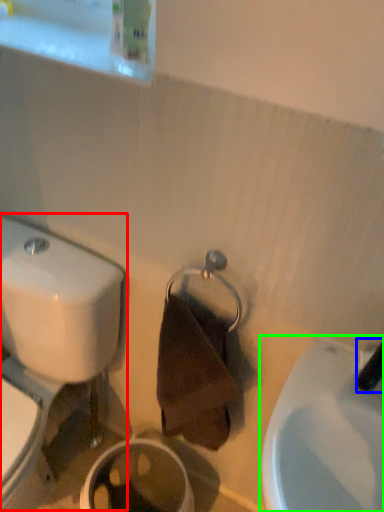
Question: Which object is positioned farthest from toilet (highlighted by a red box)? Select from plumbing fixture (highlighted by a blue box) and sink (highlighted by a green box).

Choices:
 (A) plumbing fixture
 (B) sink

Answer: (A)